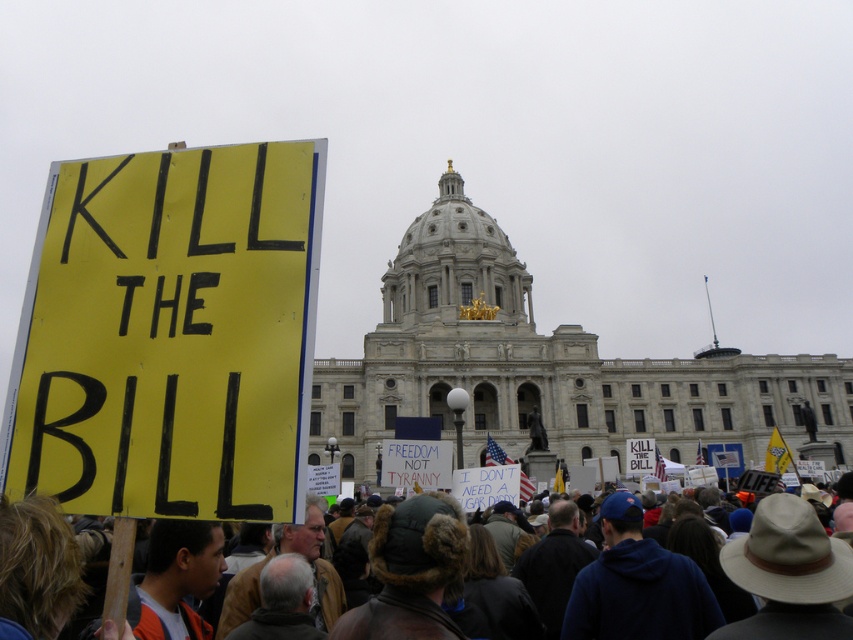
Is yellow paper sign at left below brown leather jacket at lower center?

No, yellow paper sign at left is not below brown leather jacket at lower center.

Who is positioned more to the left, yellow paper sign at left or brown leather jacket at lower center?

yellow paper sign at left is more to the left.

Is point (173, 445) positioned in front of point (634, 593)?

Yes, point (173, 445) is closer to viewer.

The width and height of the screenshot is (853, 640). In order to click on yellow paper sign at left in this screenshot , I will do [170, 333].